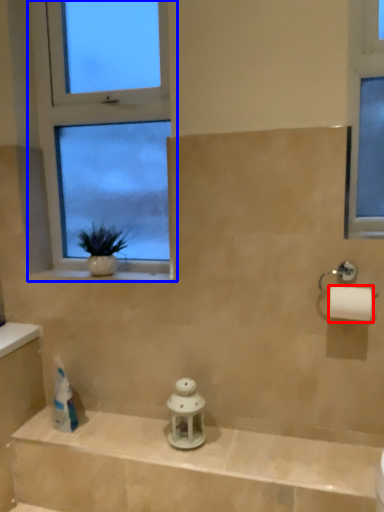
Question: Which object is further to the camera taking this photo, toilet paper (highlighted by a red box) or window (highlighted by a blue box)?

Choices:
 (A) toilet paper
 (B) window

Answer: (B)